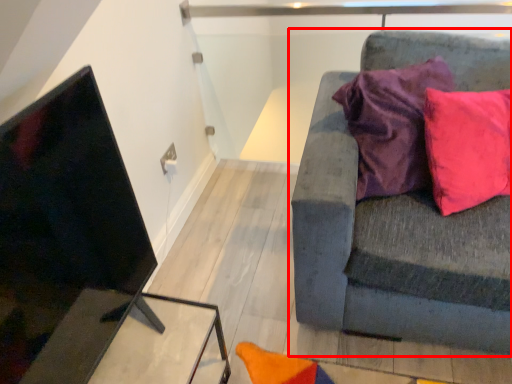
Question: From the image's perspective, what is the correct spatial positioning of studio couch (annotated by the red box) in reference to table?

Choices:
 (A) below
 (B) above

Answer: (B)